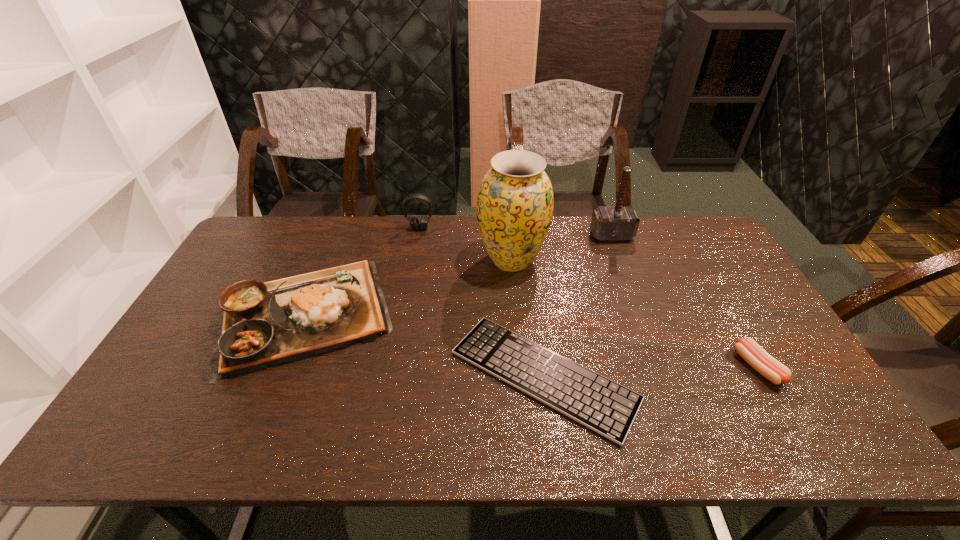
You are a GUI agent. You are given a task and a screenshot of the screen. Output one action in this format:
    pyautogui.click(x=<x>, y=<y>)
    Task: Click on the vase
    
    Given the screenshot: What is the action you would take?
    pyautogui.click(x=515, y=202)

Where is `hammer`? Image resolution: width=960 pixels, height=540 pixels. hammer is located at coordinates (618, 223).

Locate an element on the screen. This screenshot has height=540, width=960. the third tallest object is located at coordinates (414, 222).

Identify the location of the third shortest object. This screenshot has width=960, height=540. (264, 324).

The height and width of the screenshot is (540, 960). In order to click on the rightmost object in this screenshot , I will do `click(748, 349)`.

Locate an element on the screen. The image size is (960, 540). sausage is located at coordinates (748, 349).

The height and width of the screenshot is (540, 960). What are the coordinates of `the shortest object` in the screenshot? It's located at (608, 408).

Where is `vacant space located on the back of the vase`? This screenshot has width=960, height=540. vacant space located on the back of the vase is located at coordinates (509, 228).

Find the location of a particular element. Image resolution: width=960 pixels, height=540 pixels. vacant space located on the right of the hammer is located at coordinates (714, 235).

The height and width of the screenshot is (540, 960). In order to click on vacant space located on the front-facing side of the fourth shortest object in this screenshot , I will do `click(406, 311)`.